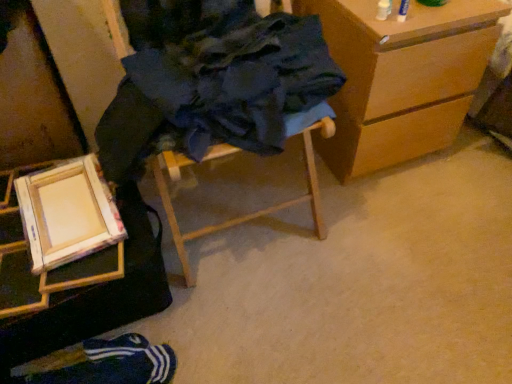
Question: Should I look upward or downward to see wooden frame at lower left?

Choices:
 (A) down
 (B) up

Answer: (A)

Question: Is wooden chest of drawers at right in front of blue fabric socks at lower left?

Choices:
 (A) yes
 (B) no

Answer: (B)

Question: From the image's perspective, is wooden chest of drawers at right on blue fabric socks at lower left?

Choices:
 (A) yes
 (B) no

Answer: (A)

Question: Is wooden chest of drawers at right further to the viewer compared to blue fabric socks at lower left?

Choices:
 (A) no
 (B) yes

Answer: (B)

Question: Can we say wooden chest of drawers at right lies outside blue fabric socks at lower left?

Choices:
 (A) yes
 (B) no

Answer: (A)

Question: Considering the relative sizes of wooden chest of drawers at right and blue fabric socks at lower left in the image provided, is wooden chest of drawers at right taller than blue fabric socks at lower left?

Choices:
 (A) no
 (B) yes

Answer: (B)

Question: Is wooden chest of drawers at right positioned with its back to blue fabric socks at lower left?

Choices:
 (A) no
 (B) yes

Answer: (A)

Question: Does wooden chest of drawers at right have a lesser width compared to wooden frame at lower left?

Choices:
 (A) no
 (B) yes

Answer: (A)

Question: Would you consider wooden chest of drawers at right to be distant from wooden frame at lower left?

Choices:
 (A) no
 (B) yes

Answer: (A)

Question: Is wooden chest of drawers at right bigger than wooden frame at lower left?

Choices:
 (A) no
 (B) yes

Answer: (B)

Question: Considering the relative sizes of wooden chest of drawers at right and wooden frame at lower left in the image provided, is wooden chest of drawers at right shorter than wooden frame at lower left?

Choices:
 (A) yes
 (B) no

Answer: (B)

Question: From a real-world perspective, is wooden chest of drawers at right positioned under wooden frame at lower left based on gravity?

Choices:
 (A) yes
 (B) no

Answer: (A)

Question: Is wooden chest of drawers at right positioned behind wooden frame at lower left?

Choices:
 (A) no
 (B) yes

Answer: (B)

Question: Considering the relative sizes of wooden chest of drawers at right and wooden easel at lower left, the first furniture viewed from the left, in the image provided, is wooden chest of drawers at right bigger than wooden easel at lower left, the first furniture viewed from the left,?

Choices:
 (A) no
 (B) yes

Answer: (B)